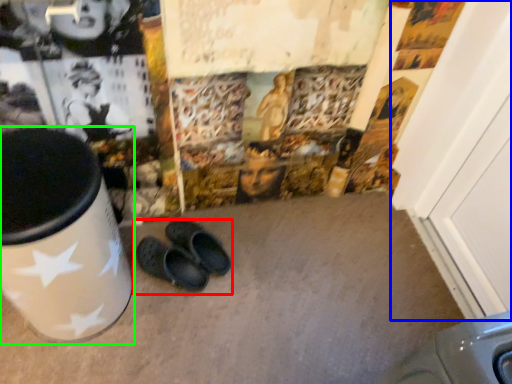
Question: Considering the real-world distances, which object is farthest from footwear (highlighted by a red box)? door (highlighted by a blue box) or waste container (highlighted by a green box)?

Choices:
 (A) door
 (B) waste container

Answer: (A)